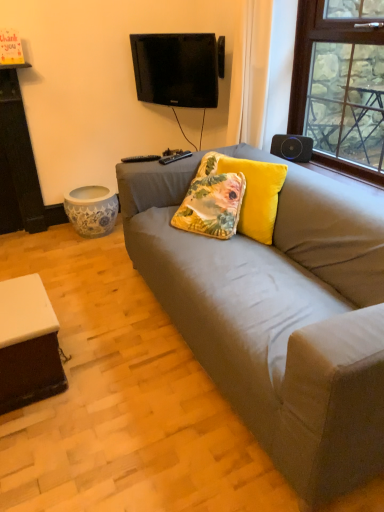
Question: Is floral fabric pillow at center, the 1th pillow positioned from the left, to the left of black matte speaker at upper right from the viewer's perspective?

Choices:
 (A) yes
 (B) no

Answer: (A)

Question: Is floral fabric pillow at center, positioned as the second pillow in right-to-left order, behind black matte speaker at upper right?

Choices:
 (A) no
 (B) yes

Answer: (A)

Question: Considering the relative sizes of floral fabric pillow at center, positioned as the second pillow in right-to-left order, and black matte speaker at upper right in the image provided, is floral fabric pillow at center, positioned as the second pillow in right-to-left order, smaller than black matte speaker at upper right?

Choices:
 (A) no
 (B) yes

Answer: (A)

Question: From a real-world perspective, is floral fabric pillow at center, the 1th pillow positioned from the left, physically above black matte speaker at upper right?

Choices:
 (A) no
 (B) yes

Answer: (A)

Question: From a real-world perspective, is floral fabric pillow at center, positioned as the second pillow in right-to-left order, below black matte speaker at upper right?

Choices:
 (A) no
 (B) yes

Answer: (B)

Question: Is black matte speaker at upper right completely or partially inside floral fabric pillow at center, the 1th pillow positioned from the left?

Choices:
 (A) yes
 (B) no

Answer: (B)

Question: Is black matte speaker at upper right positioned with its back to velvet yellow pillow at center, the 1th pillow from the right?

Choices:
 (A) no
 (B) yes

Answer: (A)

Question: Can you confirm if black matte speaker at upper right is positioned to the left of velvet yellow pillow at center, positioned as the 2th pillow in left-to-right order?

Choices:
 (A) yes
 (B) no

Answer: (B)

Question: Does black matte speaker at upper right appear on the right side of velvet yellow pillow at center, the 1th pillow from the right?

Choices:
 (A) no
 (B) yes

Answer: (B)

Question: From a real-world perspective, is black matte speaker at upper right beneath velvet yellow pillow at center, positioned as the 2th pillow in left-to-right order?

Choices:
 (A) yes
 (B) no

Answer: (B)

Question: From the image's perspective, is black matte speaker at upper right beneath velvet yellow pillow at center, the 1th pillow from the right?

Choices:
 (A) yes
 (B) no

Answer: (B)

Question: Considering the relative sizes of black matte speaker at upper right and velvet yellow pillow at center, positioned as the 2th pillow in left-to-right order, in the image provided, is black matte speaker at upper right wider than velvet yellow pillow at center, positioned as the 2th pillow in left-to-right order,?

Choices:
 (A) no
 (B) yes

Answer: (A)

Question: Is black glossy tv at upper center not inside floral fabric pillow at center, the 1th pillow positioned from the left?

Choices:
 (A) no
 (B) yes

Answer: (B)